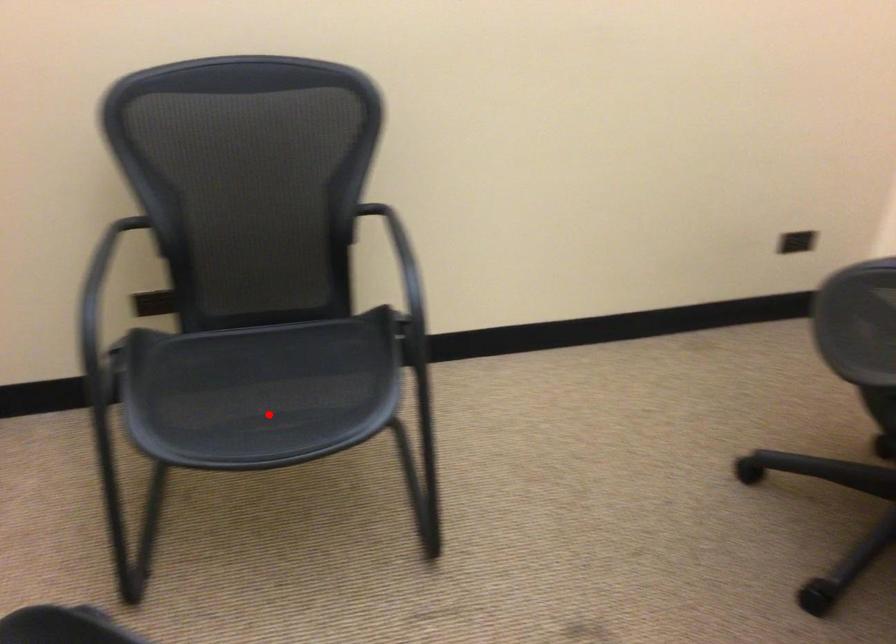
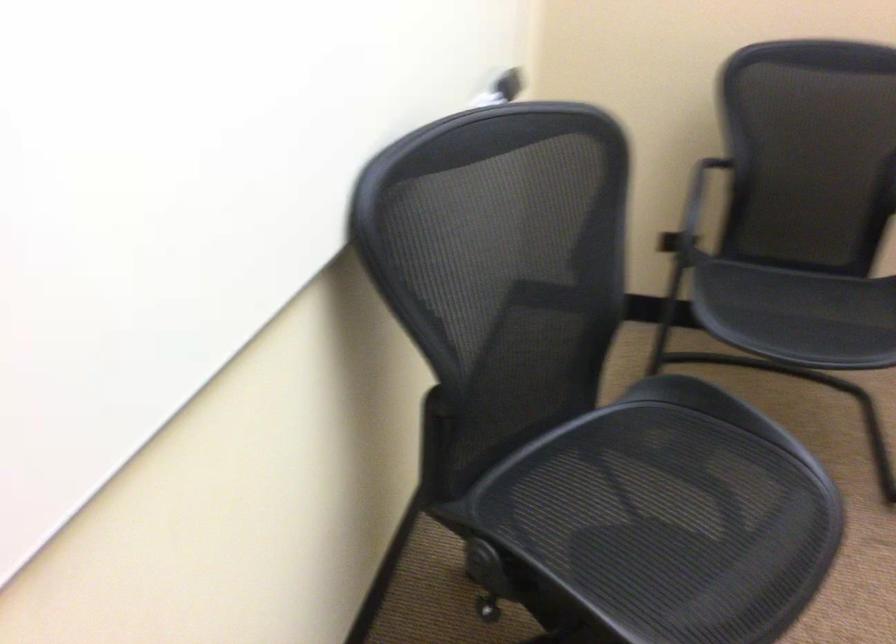
Where in the second image is the point corresponding to the highlighted location from the first image?

(798, 315)